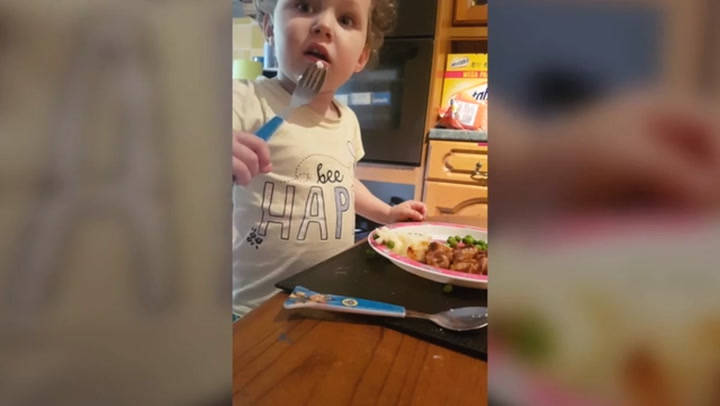
Locate an element on the screen. Image resolution: width=720 pixels, height=406 pixels. drawer handle is located at coordinates (477, 166).